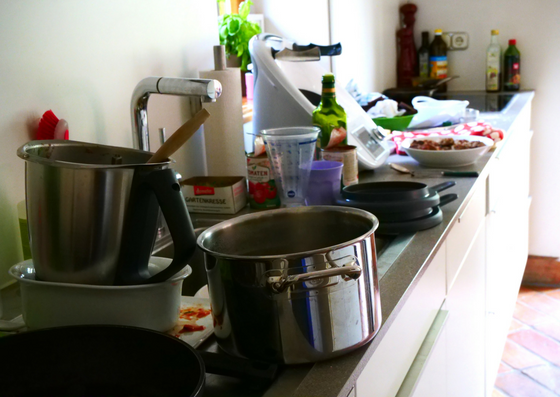
Locate an element on the screen. Image resolution: width=560 pixels, height=397 pixels. floor is located at coordinates (541, 346).